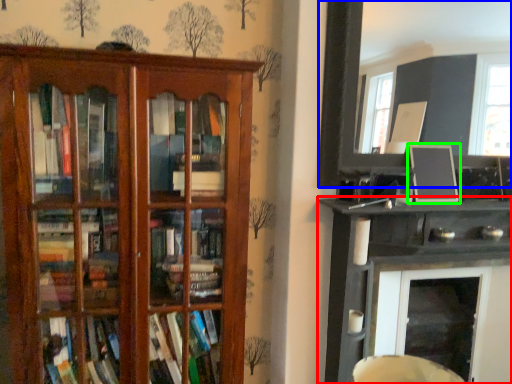
Question: Based on their relative distances, which object is nearer to shelf (highlighted by a red box)? Choose from picture frame (highlighted by a blue box) and picture frame (highlighted by a green box).

Choices:
 (A) picture frame
 (B) picture frame

Answer: (B)